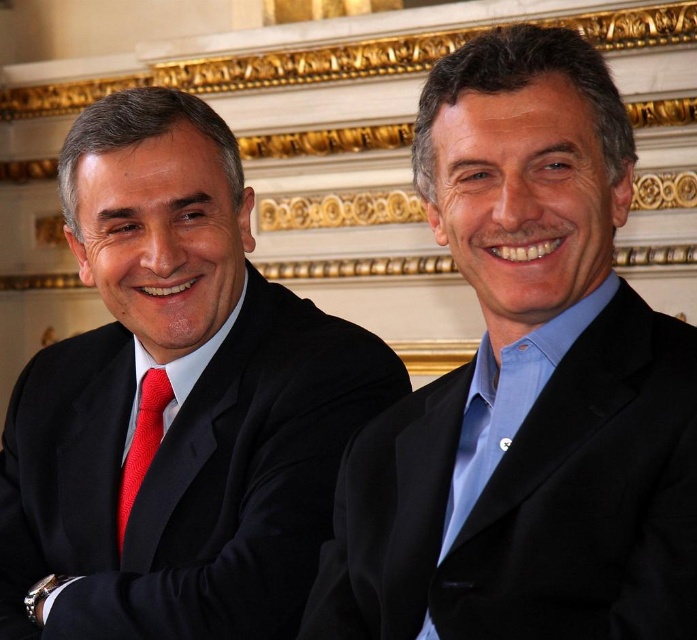
You are a photographer adjusting the camera settings to ensure both the matte black suit at left and the knitted red tie at left are in focus. Considering their positions, which object should you prioritize focusing on to ensure the subject is clear?

The matte black suit at left should be prioritized for focus since it is wider than the knitted red tie at left, making it a more prominent part of the subject.

You are a photographer adjusting the camera to focus on two points in the image. The first point is point (398, 451) and the second is point (148, 348). Which point is closer to the camera?

Point (398, 451) is closer to the camera than point (148, 348) because it is in front of it.

In the image, there are two people sitting side by side. The person on the left is wearing a dark suit with a bright red tie, and the person on the right is wearing a black suit with a light blue shirt. There is a point marked at coordinates (526, 387). Which person is closer to this point?

The blue satin suit at right is represented by point (526, 387), so the person on the right wearing the blue satin suit is closer to this point.